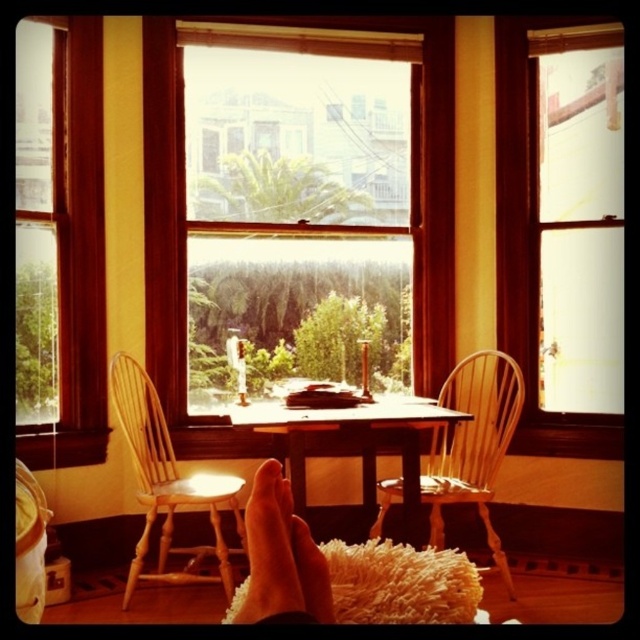
You are a person who is 5 feet tall. You want to sit on the light brown wood chair at center while reaching items on the wooden table at center. Can you comfortably reach the items on the table without straining?

The light brown wood chair at center is 11.93 inches away from the wooden table at center. Since the distance is only about 1 foot, a person who is 5 feet tall can comfortably reach the items on the table without straining.

You are standing in the room and want to look outside through the transparent glass window at center. Where should you look to see the outside view?

You should look at the transparent glass window at center located at the 2D coordinates point (529, 256) to see the outside view.

You are organizing a small gathering in the room and need to seat two people. Which chair between the light brown wood chair at center and the light brown wooden chair at center would be more suitable for someone who prefers more space?

The light brown wood chair at center is larger in size compared to the light brown wooden chair at center, so it would provide more seating space for someone who prefers more space.